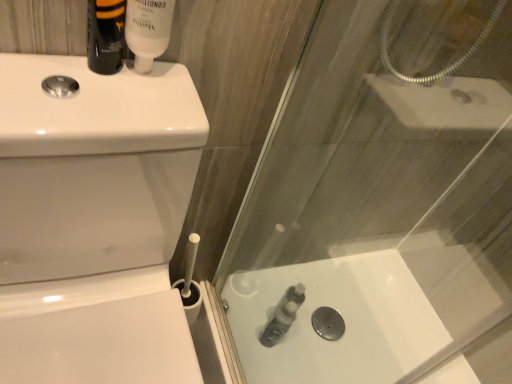
This screenshot has width=512, height=384. In order to click on free location in front of translucent plastic bottle at lower center, the 1th toiletry positioned from the back in this screenshot , I will do `click(263, 362)`.